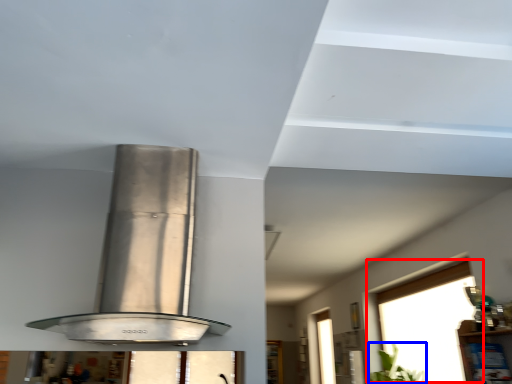
Question: Which object appears farthest to the camera in this image, window (highlighted by a red box) or plant (highlighted by a blue box)?

Choices:
 (A) window
 (B) plant

Answer: (B)